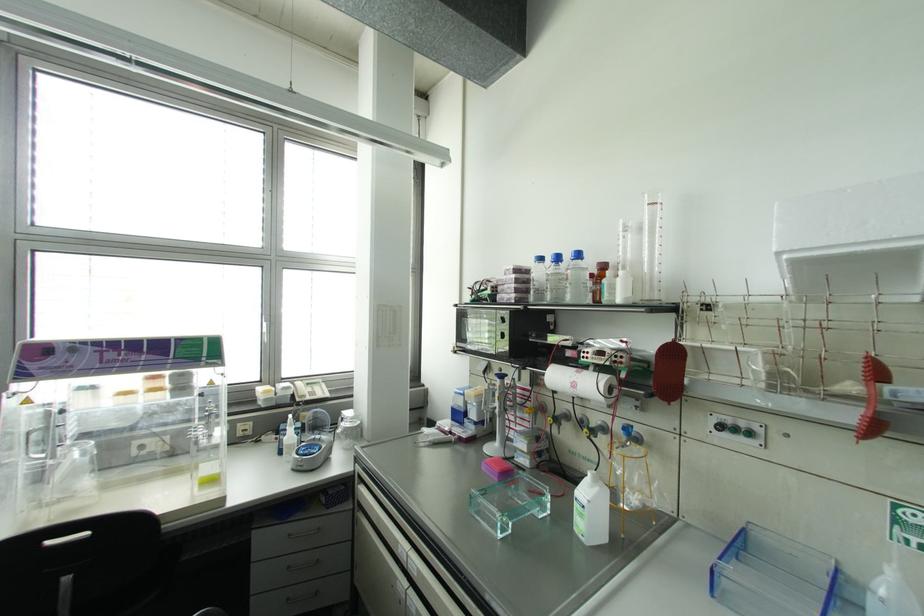
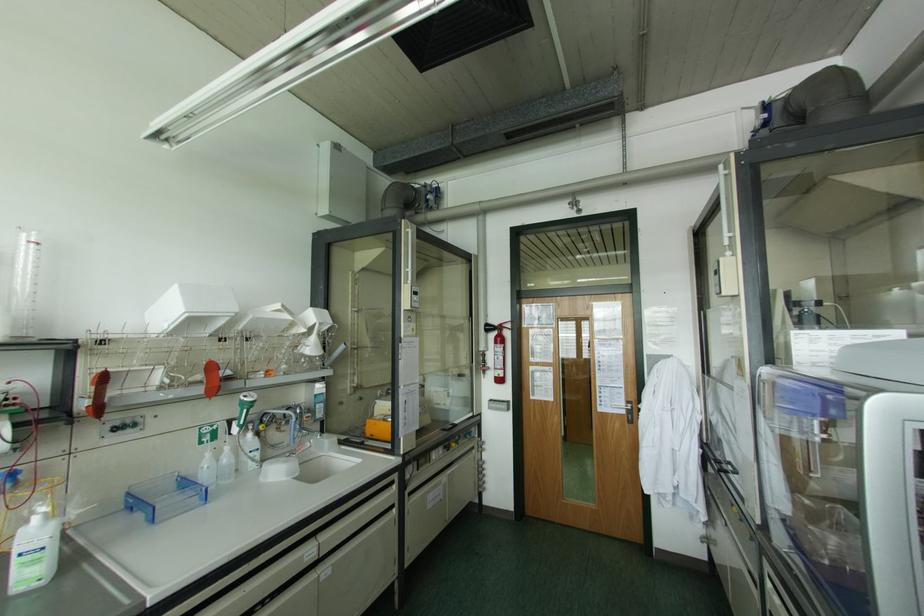
Find the pixel in the second image that matches point 744,532 in the first image.

(128, 493)